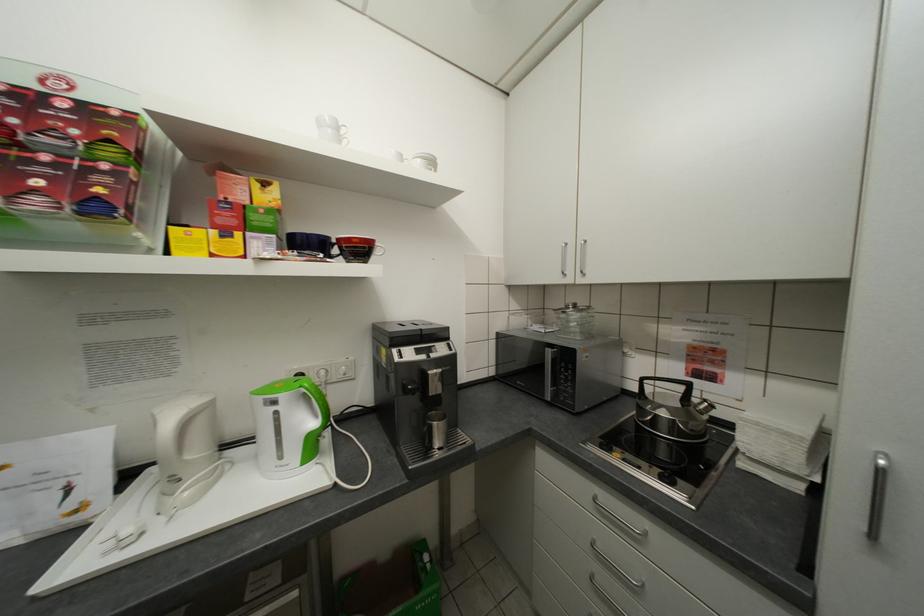
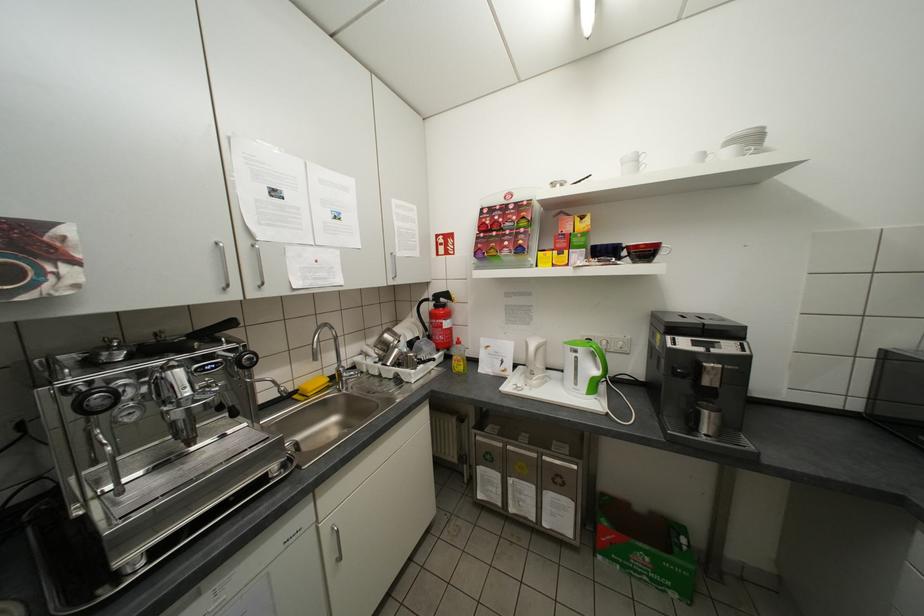
Find the pixel in the second image that matches pixel 196 493 in the first image.

(543, 382)